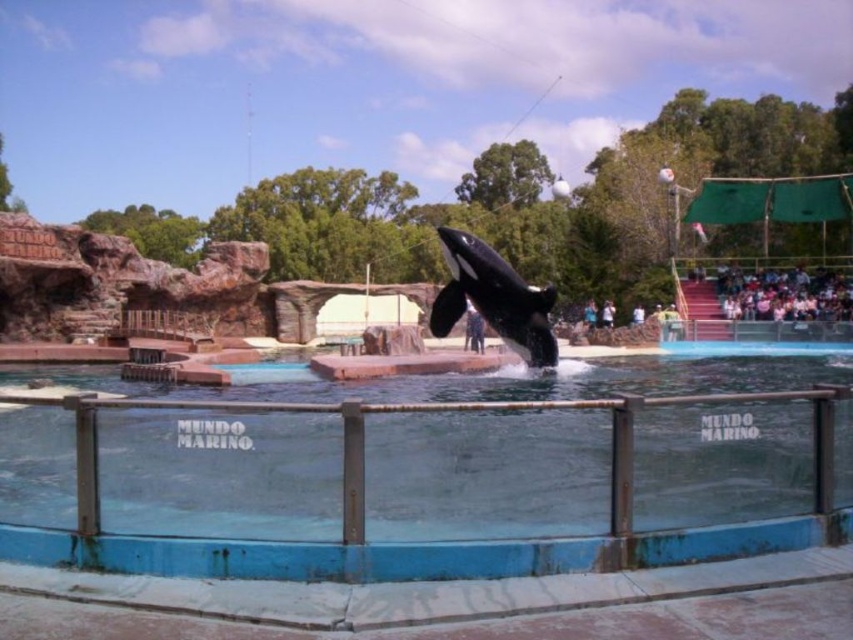
Question: Considering the relative positions of blue plastic pool at center and black smooth orca at center in the image provided, where is blue plastic pool at center located with respect to black smooth orca at center?

Choices:
 (A) above
 (B) below

Answer: (B)

Question: Is blue plastic pool at center positioned behind black smooth orca at center?

Choices:
 (A) yes
 (B) no

Answer: (B)

Question: Is blue plastic pool at center positioned in front of black smooth orca at center?

Choices:
 (A) yes
 (B) no

Answer: (A)

Question: Which point is farther to the camera?

Choices:
 (A) (514, 342)
 (B) (296, 444)

Answer: (A)